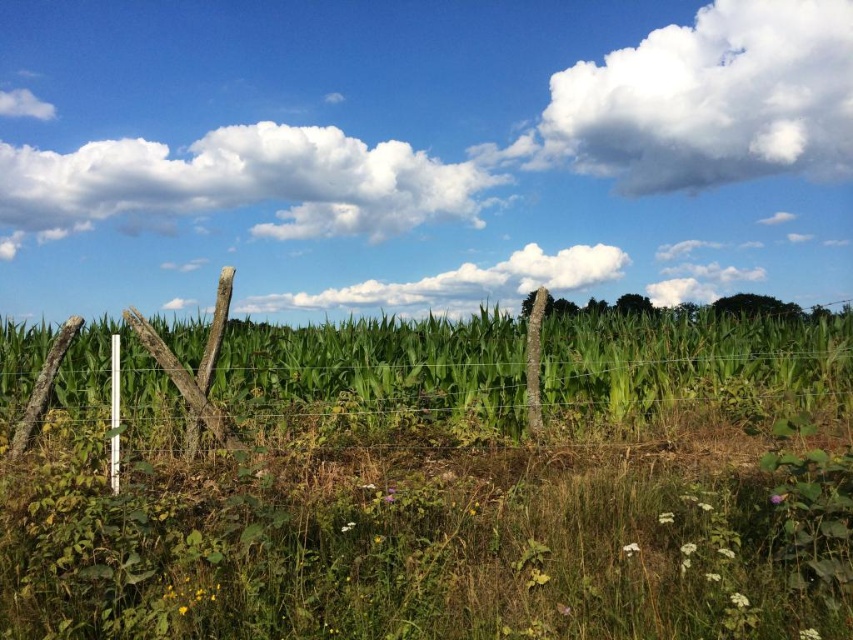
Question: Can you confirm if green leafy corn at center is wider than white fluffy cloud at center?

Choices:
 (A) yes
 (B) no

Answer: (A)

Question: Which point is closer to the camera?

Choices:
 (A) wooden fence post at left
 (B) white fluffy cloud at upper left
 (C) white fluffy cloud at center

Answer: (A)

Question: Which point is farther to the camera?

Choices:
 (A) click(799, 61)
 (B) click(422, 522)
 (C) click(683, 330)
 (D) click(360, 296)

Answer: (D)

Question: Can you confirm if white fluffy cloud at upper right is smaller than white fluffy cloud at center?

Choices:
 (A) no
 (B) yes

Answer: (B)

Question: Can you confirm if white fluffy cloud at center is smaller than wooden fence post at left?

Choices:
 (A) yes
 (B) no

Answer: (B)

Question: Which of these objects is positioned farthest from the green grass at center?

Choices:
 (A) white fluffy cloud at upper left
 (B) white fluffy cloud at center

Answer: (A)